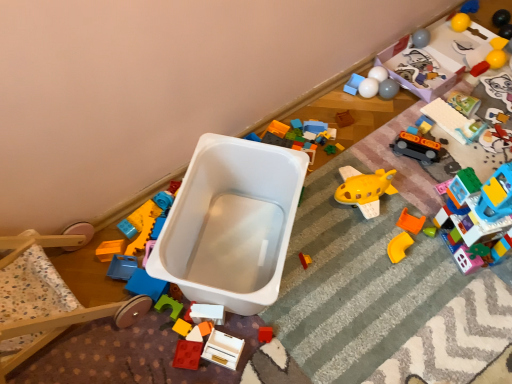
In order to click on vacant space behind matte gray cat at upper right, which is the fifteenth toy in left-to-right order in this screenshot , I will do `click(489, 66)`.